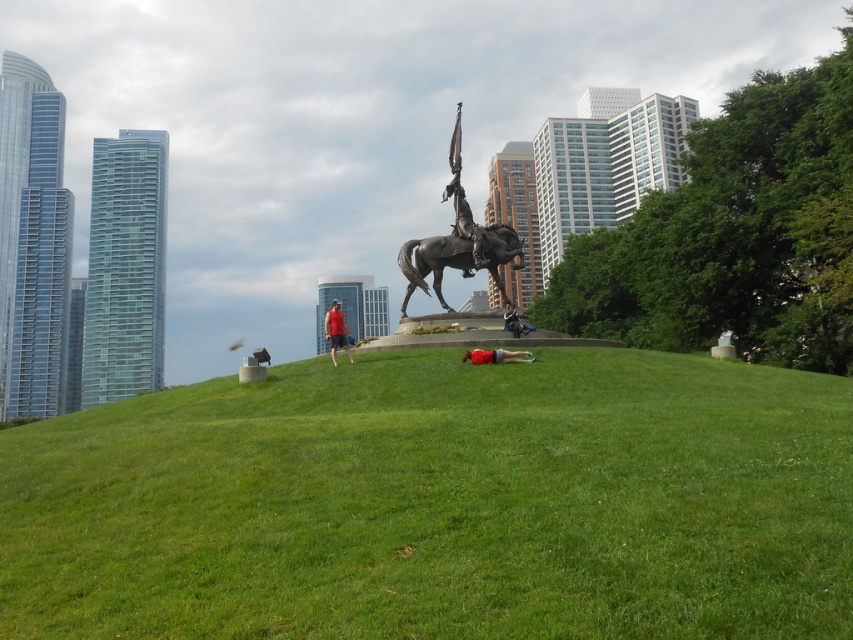
You are a photographer planning to take a wide shot of the bronze metallic horseman at center and the matte red shirt at center. Based on their sizes, which object should you focus on first to ensure both are in frame?

The bronze metallic horseman at center occupies less space than the matte red shirt at center, so you should focus on the matte red shirt at center first to ensure both are in frame.

You are a visitor in the park and want to take a photo of the bronze metallic horseman at center and the polished bronze horse at center. Which object is on top of the other in the statue?

The bronze metallic horseman at center is positioned over the polished bronze horse at center in the statue.